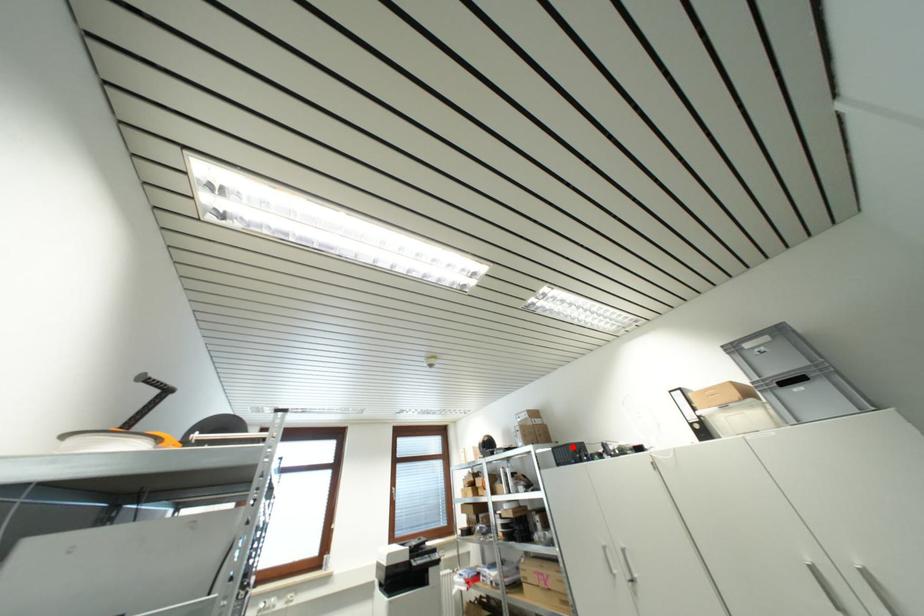
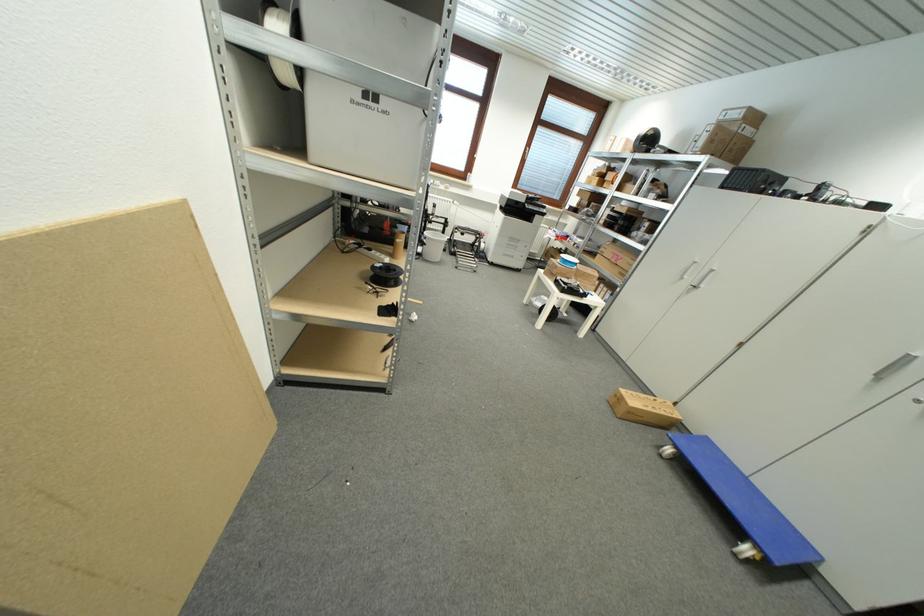
Find the pixel in the second image that matches the highlighted location in the first image.

(769, 174)